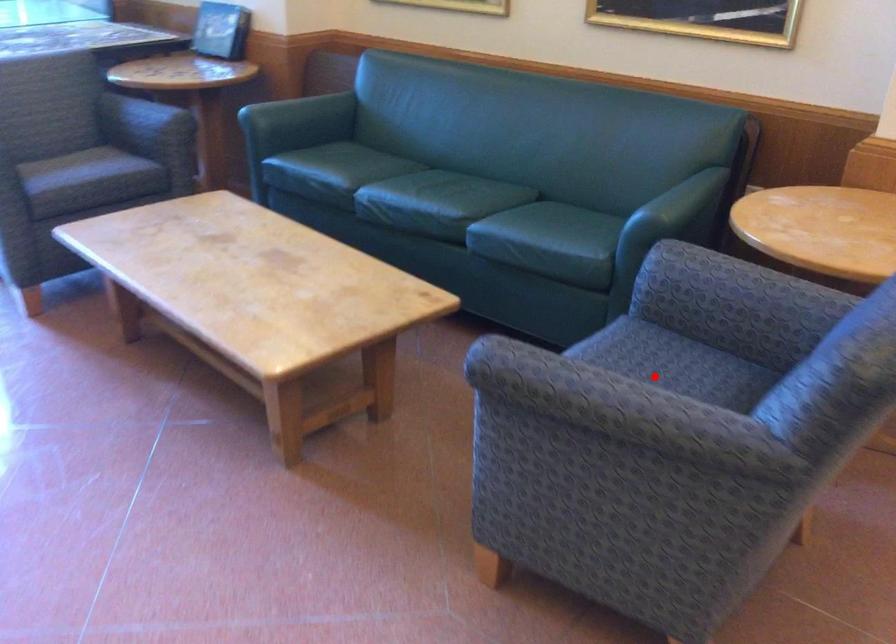
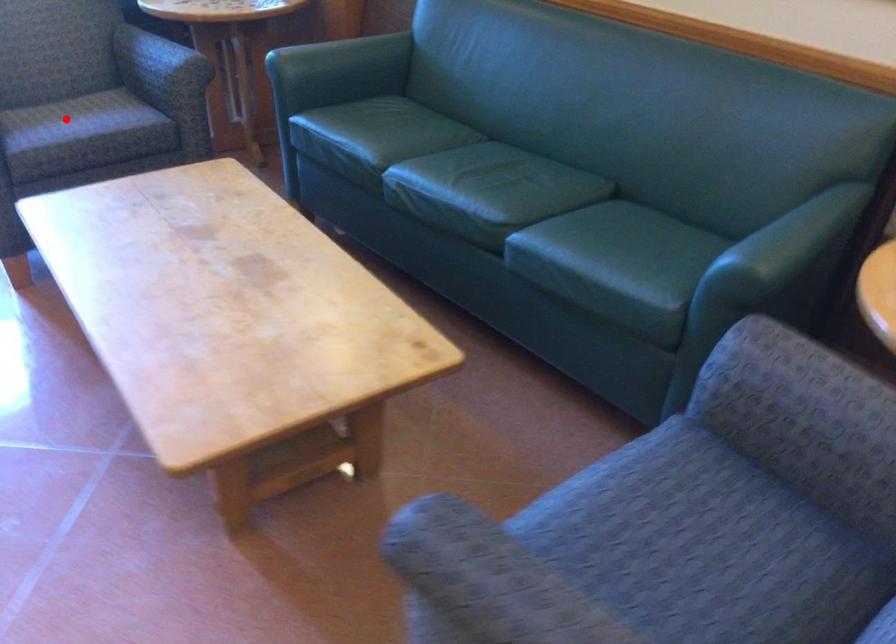
I am providing you with two images of the same scene from different viewpoints. A red point is marked on the first image and another point is marked on the second image. Is the marked point in image1 the same physical position as the marked point in image2?

No